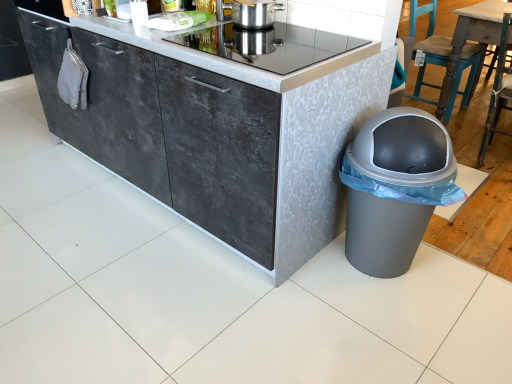
Question: Does stainless steel pot at upper center appear on the left side of wooden chair at right, the 2th chair from the back?

Choices:
 (A) no
 (B) yes

Answer: (B)

Question: Would you say stainless steel pot at upper center contains wooden chair at right, the 2th chair from the back?

Choices:
 (A) yes
 (B) no

Answer: (B)

Question: Is the position of stainless steel pot at upper center less distant than that of wooden chair at right, which ranks as the first chair in front-to-back order?

Choices:
 (A) no
 (B) yes

Answer: (B)

Question: Is stainless steel pot at upper center not near wooden chair at right, the 2th chair from the back?

Choices:
 (A) no
 (B) yes

Answer: (B)

Question: Considering the relative sizes of stainless steel pot at upper center and wooden chair at right, the 2th chair from the back, in the image provided, is stainless steel pot at upper center thinner than wooden chair at right, the 2th chair from the back,?

Choices:
 (A) yes
 (B) no

Answer: (A)

Question: In terms of width, does teal painted wood chair at right, positioned as the 2th chair in front-to-back order, look wider or thinner when compared to dark gray concrete cabinet at center?

Choices:
 (A) thin
 (B) wide

Answer: (A)

Question: Considering the positions of point (480, 49) and point (126, 33), is point (480, 49) closer or farther from the camera than point (126, 33)?

Choices:
 (A) closer
 (B) farther

Answer: (B)

Question: Is teal painted wood chair at right, positioned as the 2th chair in front-to-back order, spatially inside dark gray concrete cabinet at center, or outside of it?

Choices:
 (A) inside
 (B) outside

Answer: (B)

Question: Is teal painted wood chair at right, which is the 1th chair from back to front, to the left or to the right of dark gray concrete cabinet at center in the image?

Choices:
 (A) right
 (B) left

Answer: (A)

Question: From a real-world perspective, is gray plastic trash can at lower right positioned above or below metallic glass cooktop at center?

Choices:
 (A) above
 (B) below

Answer: (B)

Question: Is gray plastic trash can at lower right wider or thinner than metallic glass cooktop at center?

Choices:
 (A) wide
 (B) thin

Answer: (B)

Question: Is gray plastic trash can at lower right inside the boundaries of metallic glass cooktop at center, or outside?

Choices:
 (A) outside
 (B) inside

Answer: (A)

Question: Considering their positions, is gray plastic trash can at lower right located in front of or behind metallic glass cooktop at center?

Choices:
 (A) behind
 (B) front

Answer: (B)

Question: Is gray plastic trash can at lower right inside the boundaries of wooden chair at right, which ranks as the first chair in front-to-back order, or outside?

Choices:
 (A) outside
 (B) inside

Answer: (A)

Question: From a real-world perspective, is gray plastic trash can at lower right above or below wooden chair at right, which ranks as the first chair in front-to-back order?

Choices:
 (A) above
 (B) below

Answer: (B)